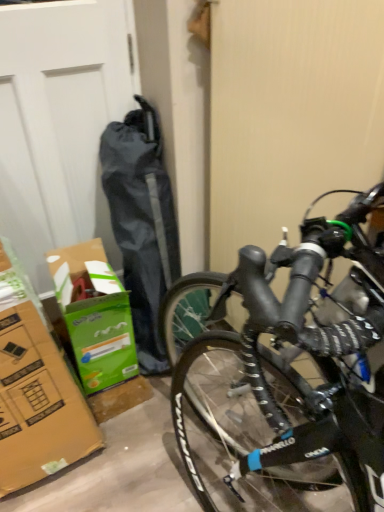
Question: Would you say black matte bicycle at right is outside white matte garage door at left?

Choices:
 (A) no
 (B) yes

Answer: (B)

Question: Is black matte bicycle at right smaller than white matte garage door at left?

Choices:
 (A) no
 (B) yes

Answer: (A)

Question: Does black matte bicycle at right have a greater height compared to white matte garage door at left?

Choices:
 (A) yes
 (B) no

Answer: (A)

Question: From the image's perspective, is black matte bicycle at right above white matte garage door at left?

Choices:
 (A) yes
 (B) no

Answer: (B)

Question: Can you confirm if black matte bicycle at right is wider than white matte garage door at left?

Choices:
 (A) no
 (B) yes

Answer: (B)

Question: From a real-world perspective, is black matte bicycle at right above or below green cardboard box at lower left?

Choices:
 (A) above
 (B) below

Answer: (A)

Question: Relative to green cardboard box at lower left, is black matte bicycle at right in front or behind?

Choices:
 (A) front
 (B) behind

Answer: (A)

Question: Visually, is black matte bicycle at right positioned to the left or to the right of green cardboard box at lower left?

Choices:
 (A) left
 (B) right

Answer: (B)

Question: From their relative heights in the image, would you say black matte bicycle at right is taller or shorter than green cardboard box at lower left?

Choices:
 (A) tall
 (B) short

Answer: (A)

Question: In terms of height, does green cardboard box at lower left look taller or shorter compared to white matte garage door at left?

Choices:
 (A) tall
 (B) short

Answer: (B)

Question: Which is correct: green cardboard box at lower left is inside white matte garage door at left, or outside of it?

Choices:
 (A) outside
 (B) inside

Answer: (A)

Question: Based on their sizes in the image, would you say green cardboard box at lower left is bigger or smaller than white matte garage door at left?

Choices:
 (A) small
 (B) big

Answer: (B)

Question: From the image's perspective, is green cardboard box at lower left positioned above or below white matte garage door at left?

Choices:
 (A) above
 (B) below

Answer: (B)

Question: From a real-world perspective, is white matte garage door at left above or below black matte bicycle at right?

Choices:
 (A) below
 (B) above

Answer: (A)

Question: From the image's perspective, is white matte garage door at left positioned above or below black matte bicycle at right?

Choices:
 (A) above
 (B) below

Answer: (A)